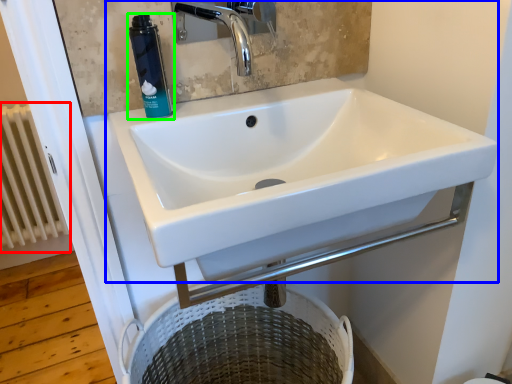
Question: Estimate the real-world distances between objects in this image. Which object is closer to radiator (highlighted by a red box), sink (highlighted by a blue box) or mouthwash (highlighted by a green box)?

Choices:
 (A) sink
 (B) mouthwash

Answer: (A)